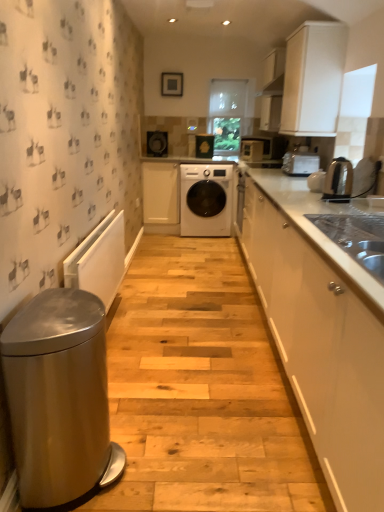
Identify the location of free location in front of metallic silver kettle at right, positioned as the 1th home appliance in front-to-back order. (337, 207).